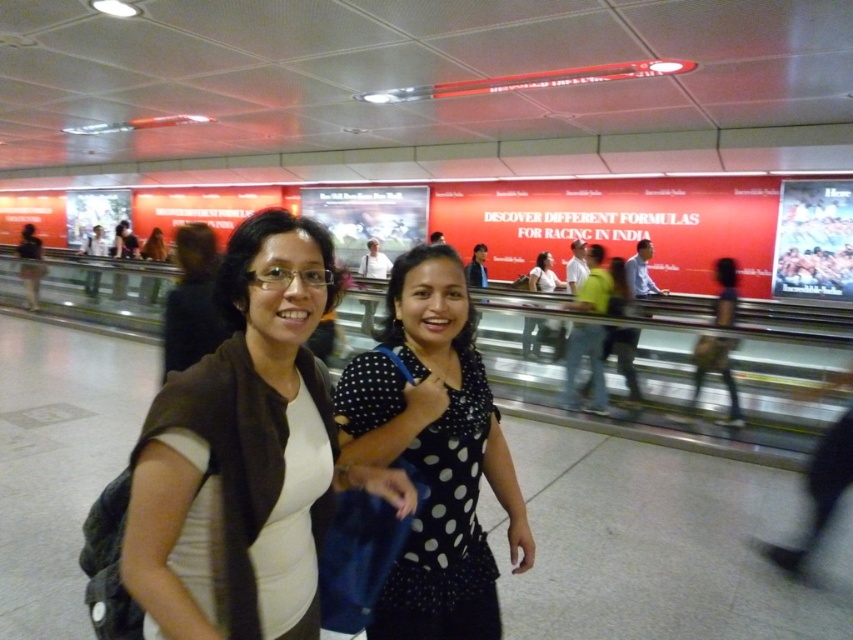
You are a photographer trying to capture a portrait of both the white matte shirt at center and the polka dot blouse at center in the scene. Since you want to ensure both subjects are in focus, you need to adjust your camera settings based on their heights. Which subject should you focus on first to ensure proper depth of field?

The white matte shirt at center is taller than the polka dot blouse at center. To ensure proper depth of field, you should focus on the taller subject first, which is the white matte shirt at center, as it will help in maintaining sharpness across both subjects.

You are a photographer in the subway station and want to capture a photo of the white matte shirt at center and the polka dot blouse at center. Which one is positioned lower in the image?

The white matte shirt at center is located below the polka dot blouse at center, so it is positioned lower in the image.

You are a photographer trying to capture both the white matte shirt at center and the black dotted dress at center in a single frame. Based on their sizes in the image, which one should you focus on first to ensure both are clearly visible?

The white matte shirt at center occupies less space than the black dotted dress at center, so you should focus on the black dotted dress at center first to ensure both are clearly visible.